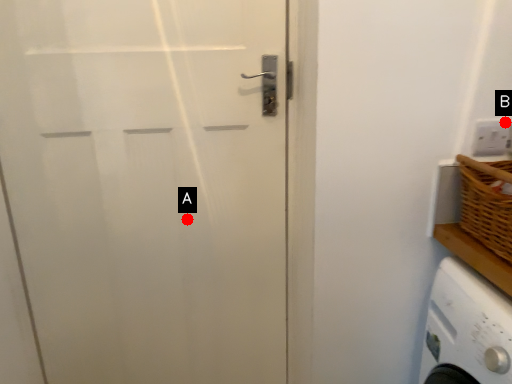
Question: Two points are circled on the image, labeled by A and B beside each circle. Which point is farther to the camera?

Choices:
 (A) A is further
 (B) B is further

Answer: (A)